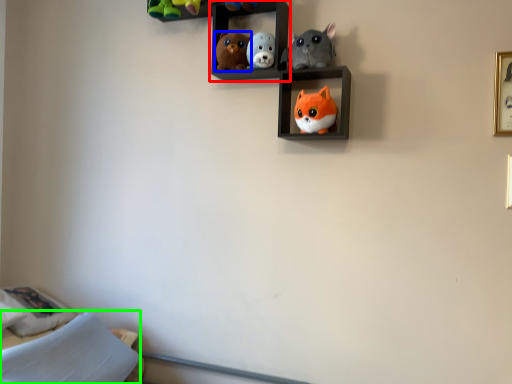
Question: Based on their relative distances, which object is nearer to shelf (highlighted by a red box)? Choose from toy (highlighted by a blue box) and pillow (highlighted by a green box).

Choices:
 (A) toy
 (B) pillow

Answer: (A)